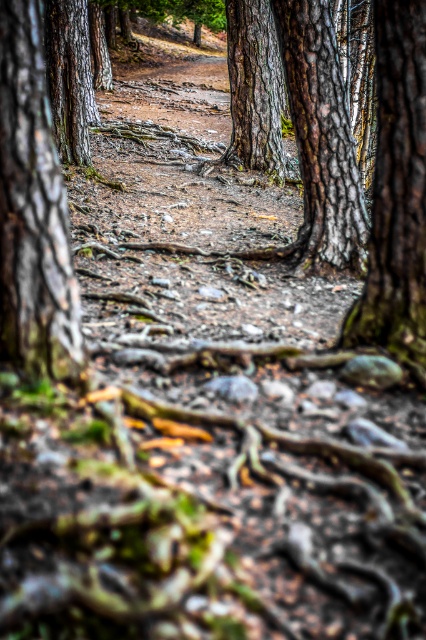
Question: Is smooth bark tree at left below smooth bark tree at center?

Choices:
 (A) yes
 (B) no

Answer: (A)

Question: Among these objects, which one is nearest to the camera?

Choices:
 (A) smooth bark tree at center
 (B) smooth bark tree at right

Answer: (B)

Question: Which object appears farthest from the camera in this image?

Choices:
 (A) smooth bark tree at center
 (B) smooth bark tree at right
 (C) smooth bark tree at left

Answer: (A)

Question: Which point appears closest to the camera in this image?

Choices:
 (A) (54, 176)
 (B) (250, 45)

Answer: (A)

Question: Can you confirm if smooth bark tree at left is positioned below smooth bark tree at center?

Choices:
 (A) yes
 (B) no

Answer: (A)

Question: Where is smooth bark tree at left located in relation to smooth bark tree at center in the image?

Choices:
 (A) right
 (B) left

Answer: (B)